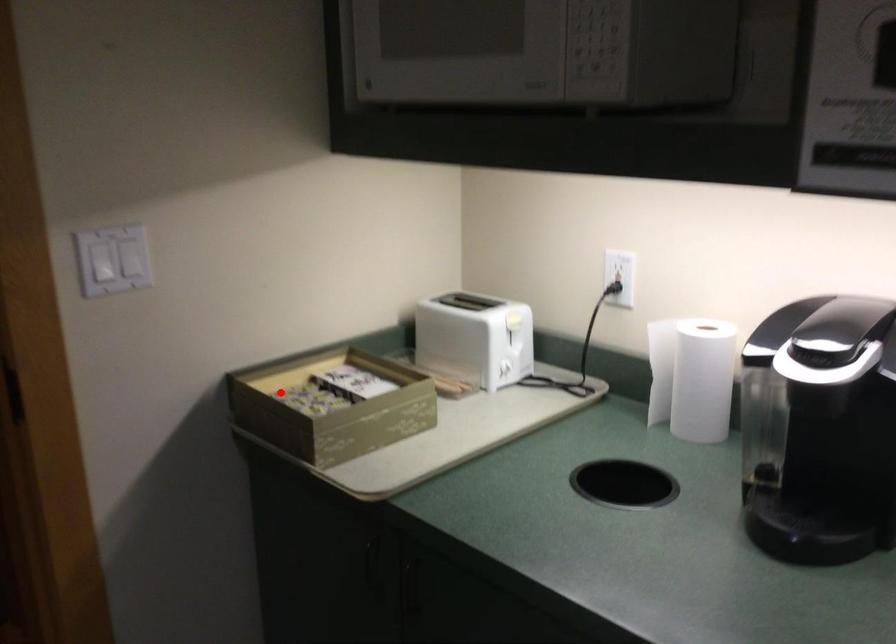
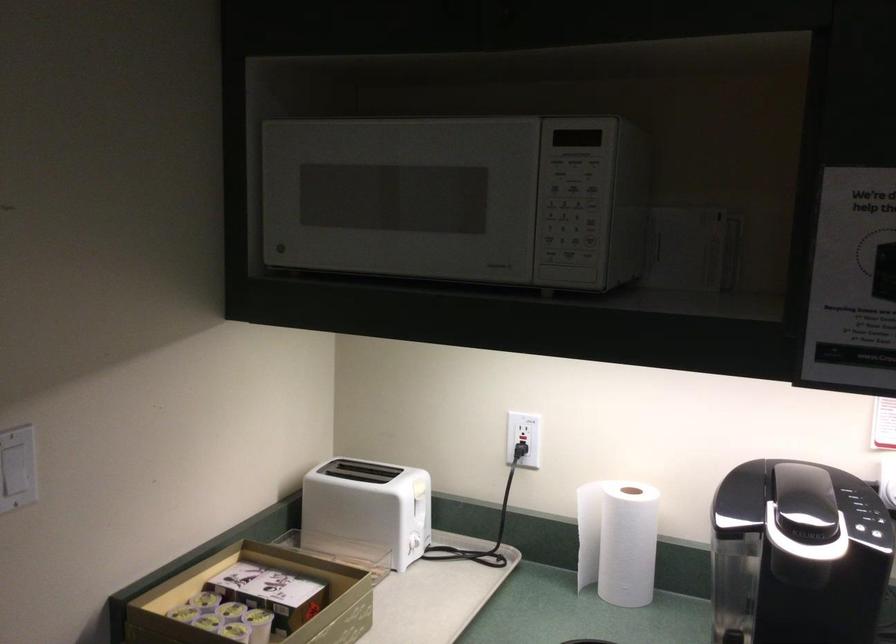
Locate, in the second image, the point that corresponds to the highlighted location in the first image.

(183, 612)